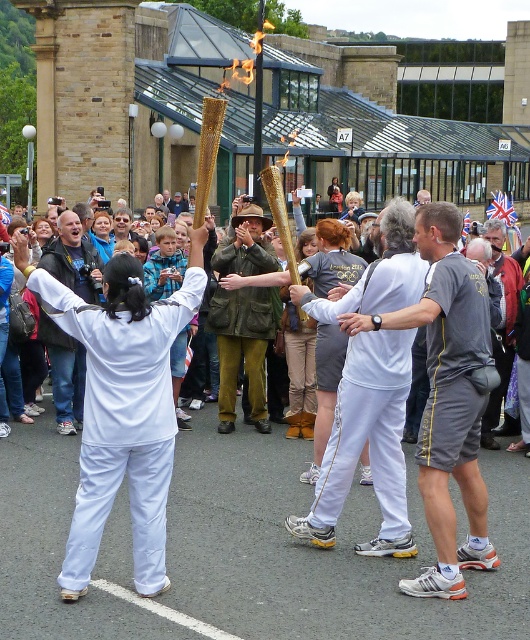
Question: Does gold metallic torch at center have a lesser width compared to white cotton t-shirt at center?

Choices:
 (A) no
 (B) yes

Answer: (A)

Question: Which point is farther from the camera taking this photo?

Choices:
 (A) (428, 401)
 (B) (220, 372)

Answer: (B)

Question: Is white cotton shorts at center smaller than white cotton t-shirt at center?

Choices:
 (A) no
 (B) yes

Answer: (A)

Question: Is gold metallic torch at center further to camera compared to white cotton shorts at center?

Choices:
 (A) yes
 (B) no

Answer: (B)

Question: Which object appears farthest from the camera in this image?

Choices:
 (A) white cloth at center
 (B) gold metallic torch at center
 (C) reddish-brown leather jacket at center

Answer: (C)

Question: Which of the following is the closest to the observer?

Choices:
 (A) reddish-brown leather jacket at center
 (B) white cotton t-shirt at center
 (C) white cotton shorts at center

Answer: (C)